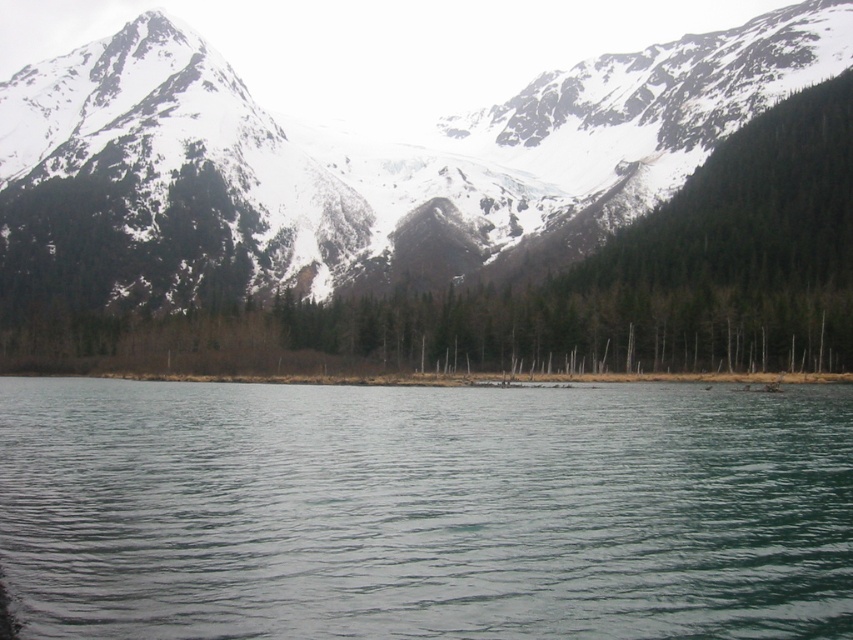
This screenshot has height=640, width=853. What are the coordinates of `clear water at center` in the screenshot? It's located at coord(424,509).